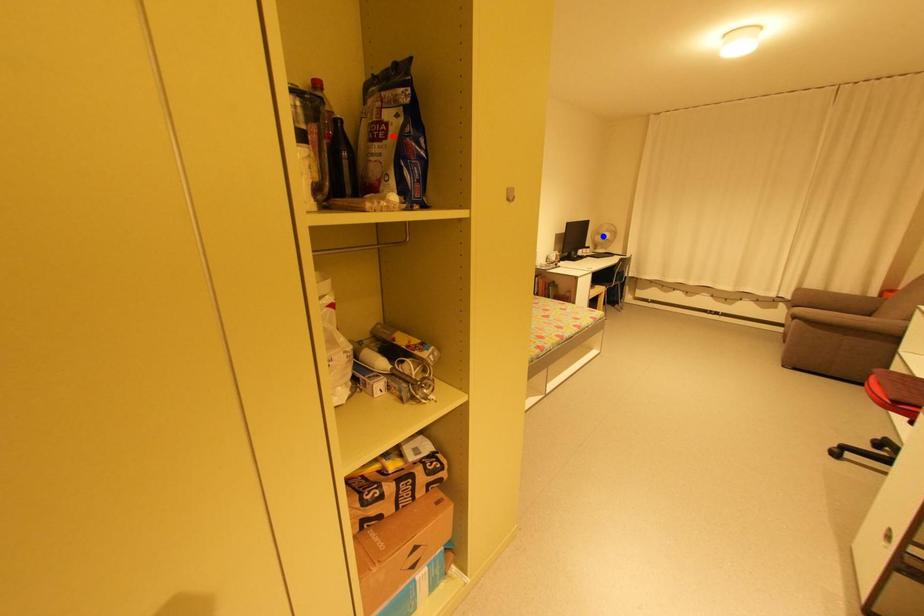
Question: Two points are marked on the image. Which point is closer to the camera?

Choices:
 (A) Blue point is closer.
 (B) Red point is closer.

Answer: (B)